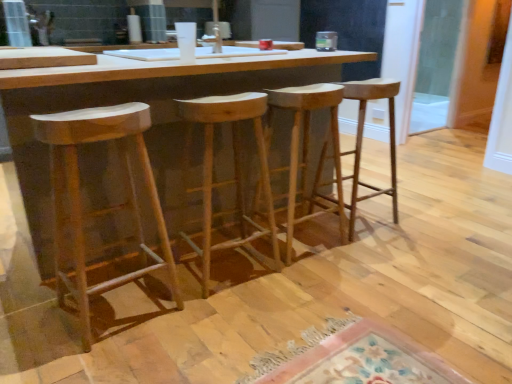
Image resolution: width=512 pixels, height=384 pixels. What are the coordinates of `free spot below natural wood stool at center, the second stool viewed from the left (from a real-world perspective)` in the screenshot? It's located at (229, 268).